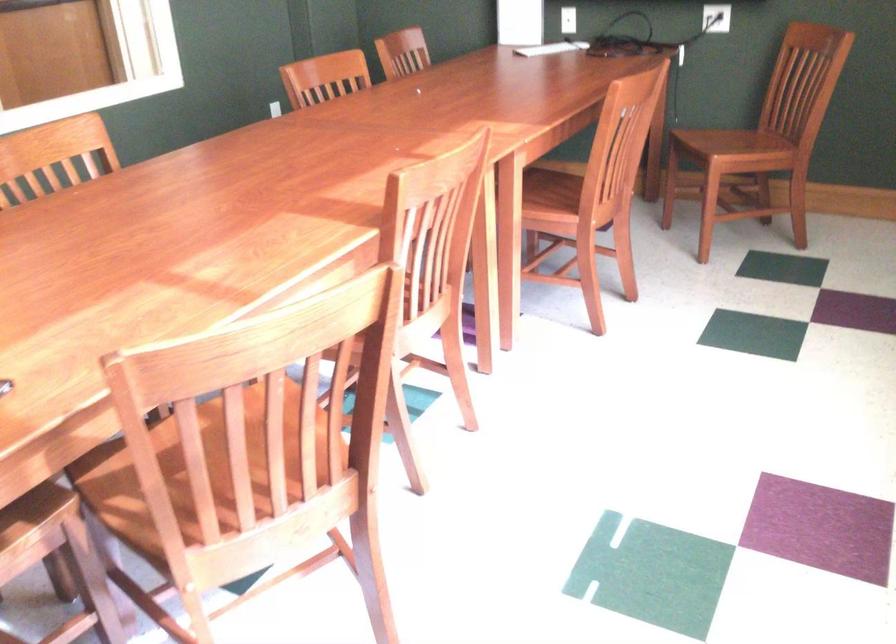
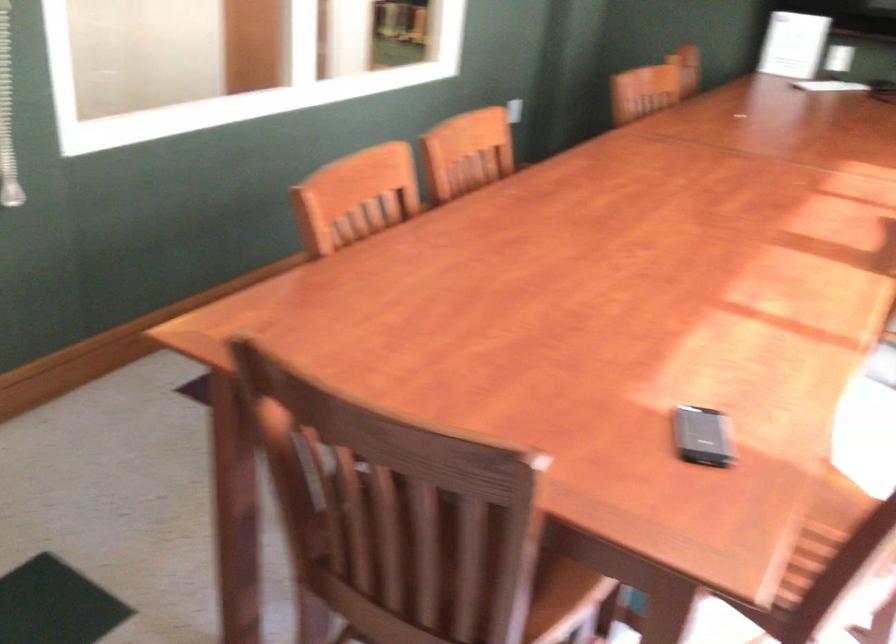
Question: What movement of the cameraman would produce the second image?

Choices:
 (A) Left
 (B) Right
 (C) Forward
 (D) Backward

Answer: (A)